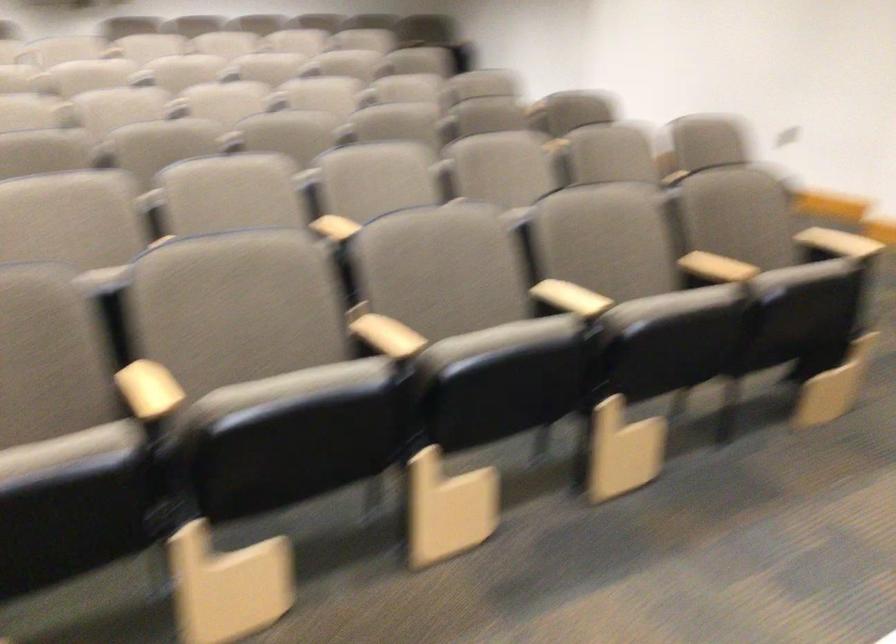
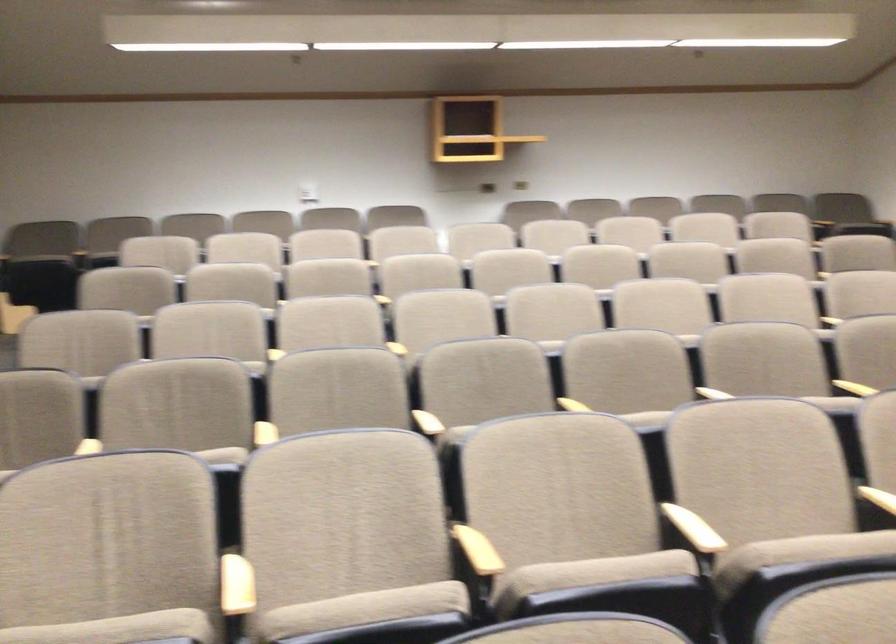
Find the pixel in the second image that matches point 304,222 in the first image.

(877, 498)